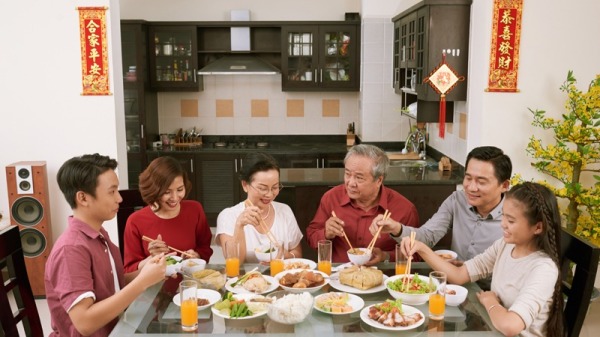
Identify the location of counter top. (414, 168), (313, 173), (286, 143).